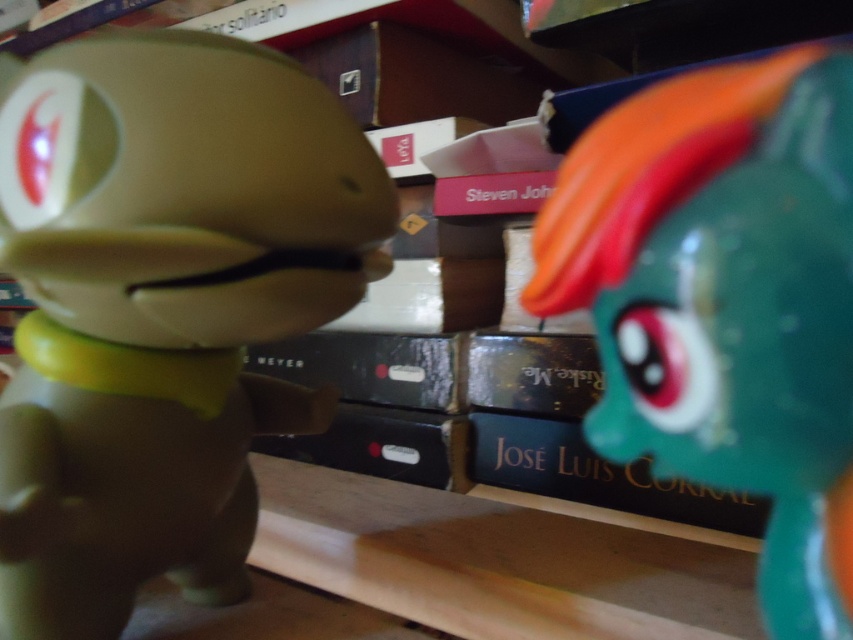
Is point (236, 186) closer to camera compared to point (573, 448)?

That is True.

Does matte green toy at left have a lesser width compared to gold textured book at center?

No.

Which is in front, point (204, 310) or point (585, 490)?

Positioned in front is point (204, 310).

Locate an element on the screen. The height and width of the screenshot is (640, 853). matte green toy at left is located at coordinates (161, 307).

Is matte green toy at left bigger than teal rubber toy at right?

No, matte green toy at left is not bigger than teal rubber toy at right.

Between point (67, 634) and point (795, 301), which one is positioned in front?

Point (795, 301) is more forward.

Does point (77, 276) lie behind point (784, 86)?

Yes, it is behind point (784, 86).

Image resolution: width=853 pixels, height=640 pixels. In order to click on matte green toy at left in this screenshot , I will do `click(161, 307)`.

Measure the distance between teal rubber toy at right and camera.

9.07 inches

Does teal rubber toy at right appear over gold textured book at center?

Yes, teal rubber toy at right is above gold textured book at center.

Which is behind, point (787, 573) or point (479, 435)?

Point (479, 435)

Locate an element on the screen. teal rubber toy at right is located at coordinates (724, 301).